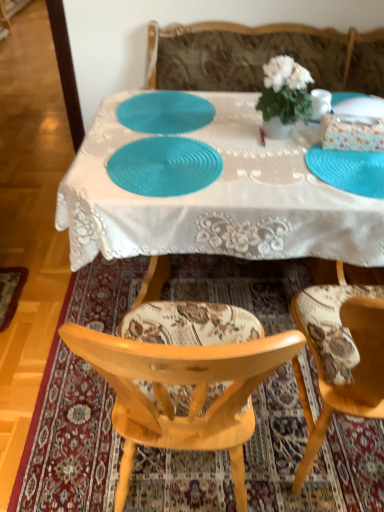
Measure the distance between point (286, 291) and camera.

Point (286, 291) is 6.47 feet away from camera.

You are a GUI agent. You are given a task and a screenshot of the screen. Output one action in this format:
    pyautogui.click(x=<x>, y=<y>)
    Task: Click on the blue textured placemat at center, the 1th plate positioned from the left
    This screenshot has width=384, height=512.
    Given the screenshot: What is the action you would take?
    pyautogui.click(x=165, y=112)

Where is `patterned fabric chair at center`? patterned fabric chair at center is located at coordinates (x=341, y=355).

In the scene shown: Considering the relative sizes of floral fabric chair at lower center and camouflage fabric couch at center in the image provided, is floral fabric chair at lower center wider than camouflage fabric couch at center?

Correct, the width of floral fabric chair at lower center exceeds that of camouflage fabric couch at center.

From the image's perspective, between floral fabric chair at lower center and camouflage fabric couch at center, which one is located above?

camouflage fabric couch at center.

From a real-world perspective, who is located lower, floral fabric chair at lower center or camouflage fabric couch at center?

floral fabric chair at lower center.

Which is behind, point (90, 432) or point (383, 66)?

The point (383, 66) is behind.

Considering the sizes of blue textured placemat at center, which is counted as the 3th plate, starting from the right, and floral fabric chair at lower center in the image, is blue textured placemat at center, which is counted as the 3th plate, starting from the right, wider or thinner than floral fabric chair at lower center?

Considering their sizes, blue textured placemat at center, which is counted as the 3th plate, starting from the right, looks slimmer than floral fabric chair at lower center.

Would you say blue textured placemat at center, which is counted as the 3th plate, starting from the right, is inside or outside floral fabric chair at lower center?

blue textured placemat at center, which is counted as the 3th plate, starting from the right, is spatially situated outside floral fabric chair at lower center.

Could you tell me if blue textured placemat at center, the 1th plate positioned from the left, is facing floral fabric chair at lower center?

No, blue textured placemat at center, the 1th plate positioned from the left, is not aimed at floral fabric chair at lower center.

The width and height of the screenshot is (384, 512). What are the coordinates of `chair that appears on the right of white lace tablecloth at center` in the screenshot? It's located at (341, 355).

From the picture: Considering the positions of objects white lace tablecloth at center and patterned fabric chair at center in the image provided, who is in front, white lace tablecloth at center or patterned fabric chair at center?

Positioned in front is patterned fabric chair at center.

How different are the orientations of white lace tablecloth at center and patterned fabric chair at center in degrees?

The angular difference between white lace tablecloth at center and patterned fabric chair at center is 176 degrees.

From the image's perspective, which one is positioned higher, white lace tablecloth at center or patterned fabric chair at center?

white lace tablecloth at center is shown above in the image.

From a real-world perspective, who is located lower, patterned fabric chair at center or teal textured plate at center, acting as the 2th plate starting from the left?

patterned fabric chair at center.

Between point (302, 293) and point (170, 192), which one is positioned in front?

Positioned in front is point (170, 192).

Locate an element on the screen. Image resolution: width=384 pixels, height=512 pixels. the 1st plate counting from the left of the patterned fabric chair at center is located at coordinates coord(164,166).

In the scene shown: Measure the distance between patterned fabric chair at center and teal textured plate at center, acting as the second plate starting from the right.

They are 24.36 inches apart.

Looking at this image, is teal textured plate at center, acting as the second plate starting from the right, positioned beyond the bounds of white lace tablecloth at center?

No, teal textured plate at center, acting as the second plate starting from the right, is inside white lace tablecloth at center's boundary.

Does teal textured plate at center, acting as the 2th plate starting from the left, have a greater height compared to white lace tablecloth at center?

In fact, teal textured plate at center, acting as the 2th plate starting from the left, may be shorter than white lace tablecloth at center.

Is point (163, 150) farther from viewer compared to point (285, 218)?

Yes, it is.

Consider the image. Can you confirm if camouflage fabric couch at center is bigger than blue rubber placemat at lower right, the 1th plate viewed from the right?

Yes.

In terms of width, does camouflage fabric couch at center look wider or thinner when compared to blue rubber placemat at lower right, the 3th plate from the left?

Clearly, camouflage fabric couch at center has more width compared to blue rubber placemat at lower right, the 3th plate from the left.

Is the position of camouflage fabric couch at center less distant than that of blue rubber placemat at lower right, the 1th plate viewed from the right?

No, camouflage fabric couch at center is further to the viewer.

Which of these two, white matte flower pot at center or white lace tablecloth at center, is smaller?

With smaller size is white matte flower pot at center.

From the image's perspective, would you say white matte flower pot at center is positioned over white lace tablecloth at center?

Yes, from the image's perspective, white matte flower pot at center is over white lace tablecloth at center.

Find the location of a particular element. Image resolution: width=384 pixels, height=512 pixels. desk in front of the white matte flower pot at center is located at coordinates (218, 198).

Is white matte flower pot at center to the right of white lace tablecloth at center from the viewer's perspective?

Yes, white matte flower pot at center is to the right of white lace tablecloth at center.

Where is `studio couch above the floral fabric chair at lower center (from a real-world perspective)`? The height and width of the screenshot is (512, 384). studio couch above the floral fabric chair at lower center (from a real-world perspective) is located at coordinates (261, 56).

Where is `mat directly beneath the blue textured placemat at center, which is counted as the 3th plate, starting from the right (from a real-world perspective)`? mat directly beneath the blue textured placemat at center, which is counted as the 3th plate, starting from the right (from a real-world perspective) is located at coordinates (69, 441).

Estimate the real-world distances between objects in this image. Which object is further from teal textured plate at center, acting as the second plate starting from the right, white matte flower pot at center or camouflage fabric couch at center?

camouflage fabric couch at center is further to teal textured plate at center, acting as the second plate starting from the right.

From the image, which object appears to be farther from floral fabric chair at lower center, white matte flower pot at center or camouflage fabric couch at center?

camouflage fabric couch at center.

When comparing their distances from blue rubber placemat at lower right, the 3th plate from the left, does teal textured plate at center, acting as the 2th plate starting from the left, or blue textured placemat at center, which is counted as the 3th plate, starting from the right, seem further?

blue textured placemat at center, which is counted as the 3th plate, starting from the right, lies further to blue rubber placemat at lower right, the 3th plate from the left, than the other object.

From the image, which object appears to be farther from white matte flower pot at center, patterned fabric chair at center or teal textured plate at center, acting as the 2th plate starting from the left?

patterned fabric chair at center is further to white matte flower pot at center.

Based on their spatial positions, is blue textured placemat at center, which is counted as the 3th plate, starting from the right, or floral fabric chair at lower center further from teal textured plate at center, acting as the 2th plate starting from the left?

The object further to teal textured plate at center, acting as the 2th plate starting from the left, is floral fabric chair at lower center.

Based on their spatial positions, is blue rubber placemat at lower right, the 3th plate from the left, or white matte flower pot at center closer to patterned fabric chair at center?

Among the two, blue rubber placemat at lower right, the 3th plate from the left, is located nearer to patterned fabric chair at center.

From the image, which object appears to be nearer to floral fabric chair at lower center, white matte flower pot at center or white lace tablecloth at center?

white lace tablecloth at center is closer to floral fabric chair at lower center.

Considering their positions, is camouflage fabric couch at center positioned further to blue textured placemat at center, the 1th plate positioned from the left, than patterned fabric chair at center?

patterned fabric chair at center lies further to blue textured placemat at center, the 1th plate positioned from the left, than the other object.

Where is `houseplant between camouflage fabric couch at center and floral fabric chair at lower center in the vertical direction`? houseplant between camouflage fabric couch at center and floral fabric chair at lower center in the vertical direction is located at coordinates (284, 96).

Where is `plate that lies between white lace tablecloth at center and floral fabric chair at lower center from top to bottom`? plate that lies between white lace tablecloth at center and floral fabric chair at lower center from top to bottom is located at coordinates (348, 170).

At what (x,y) coordinates should I click in order to perform the action: click on chair between teal textured plate at center, acting as the 2th plate starting from the left, and blue rubber placemat at lower right, the 3th plate from the left. Please return your answer as a coordinate pair (x, y). This screenshot has width=384, height=512. Looking at the image, I should click on (341, 355).

Identify the location of houseplant between camouflage fabric couch at center and blue rubber placemat at lower right, the 1th plate viewed from the right, in the vertical direction. (284, 96).